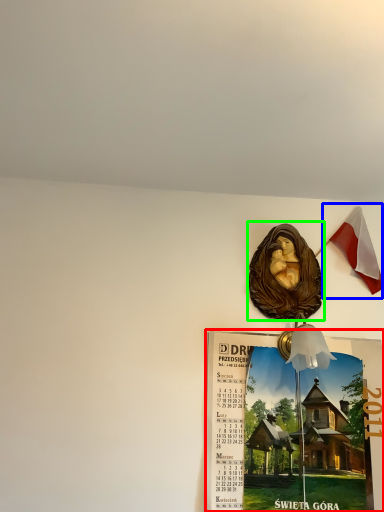
Question: Considering the real-world distances, which object is farthest from poster page (highlighted by a red box)? national flag (highlighted by a blue box) or art (highlighted by a green box)?

Choices:
 (A) national flag
 (B) art

Answer: (A)